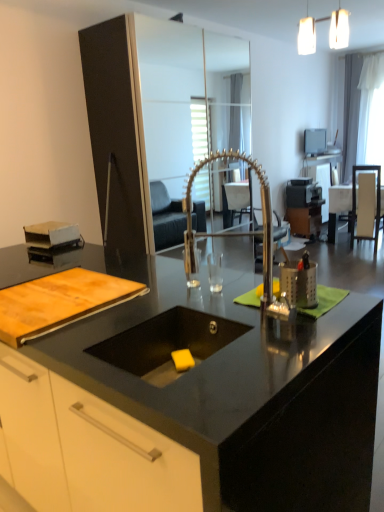
Question: Is wooden table at right positioned in front of polished metallic faucet at center?

Choices:
 (A) no
 (B) yes

Answer: (A)

Question: Is polished metallic faucet at center completely or partially inside wooden table at right?

Choices:
 (A) yes
 (B) no

Answer: (B)

Question: From a real-world perspective, is wooden table at right physically above polished metallic faucet at center?

Choices:
 (A) no
 (B) yes

Answer: (A)

Question: Can you see wooden table at right touching polished metallic faucet at center?

Choices:
 (A) yes
 (B) no

Answer: (B)

Question: Does wooden table at right appear on the right side of polished metallic faucet at center?

Choices:
 (A) yes
 (B) no

Answer: (A)

Question: From a real-world perspective, is wooden table at right positioned above or below matte black television at upper center?

Choices:
 (A) above
 (B) below

Answer: (B)

Question: Is wooden table at right inside or outside of matte black television at upper center?

Choices:
 (A) outside
 (B) inside

Answer: (A)

Question: Based on their sizes in the image, would you say wooden table at right is bigger or smaller than matte black television at upper center?

Choices:
 (A) small
 (B) big

Answer: (B)

Question: Is wooden table at right wider or thinner than matte black television at upper center?

Choices:
 (A) wide
 (B) thin

Answer: (A)

Question: Is point (367, 164) closer or farther from the camera than point (329, 221)?

Choices:
 (A) closer
 (B) farther

Answer: (A)

Question: Based on their positions, is white fabric armchair at right located to the left or right of wooden table at right?

Choices:
 (A) right
 (B) left

Answer: (B)

Question: Considering the positions of white fabric armchair at right and wooden table at right in the image, is white fabric armchair at right wider or thinner than wooden table at right?

Choices:
 (A) thin
 (B) wide

Answer: (A)

Question: Is white fabric armchair at right in front of or behind wooden table at right in the image?

Choices:
 (A) behind
 (B) front

Answer: (B)

Question: From their relative heights in the image, would you say black granite countertop at center is taller or shorter than black glossy sink at center?

Choices:
 (A) short
 (B) tall

Answer: (B)

Question: Would you say black granite countertop at center is to the left or to the right of black glossy sink at center in the picture?

Choices:
 (A) left
 (B) right

Answer: (A)